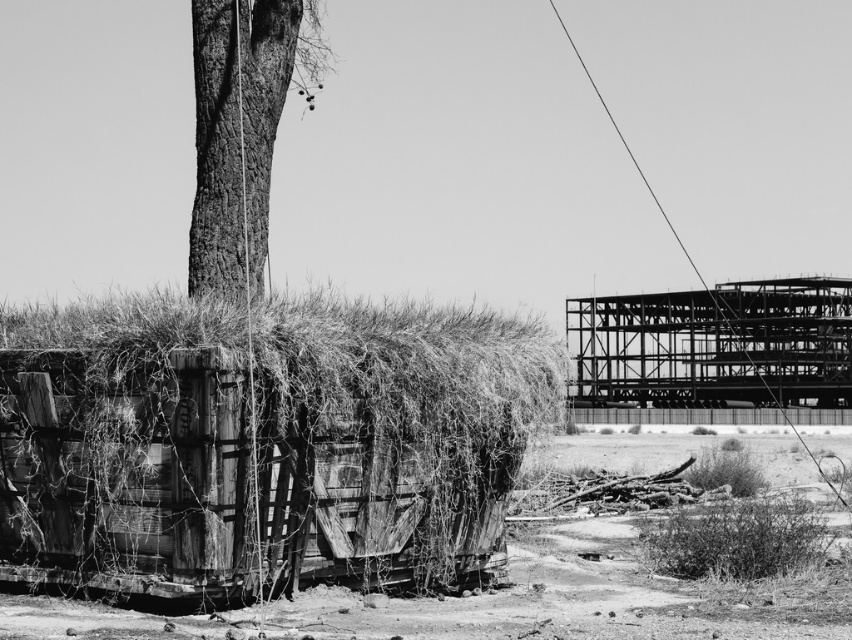
Question: Observing the image, what is the correct spatial positioning of rusty wood hay at left in reference to smooth bark tree at upper left?

Choices:
 (A) below
 (B) above

Answer: (A)

Question: Which of the following is the closest to the observer?

Choices:
 (A) metallic framework at right
 (B) smooth bark tree at upper left
 (C) rusty wood hay at left
 (D) dirt field at lower left

Answer: (D)

Question: Does rusty wood hay at left have a greater width compared to dirt field at lower left?

Choices:
 (A) yes
 (B) no

Answer: (B)

Question: Which point is closer to the camera taking this photo?

Choices:
 (A) (527, 428)
 (B) (470, 637)
 (C) (210, 252)

Answer: (B)

Question: Can you confirm if rusty wood hay at left is positioned above metallic framework at right?

Choices:
 (A) no
 (B) yes

Answer: (B)

Question: Which object is positioned closest to the metallic framework at right?

Choices:
 (A) rusty wood hay at left
 (B) smooth bark tree at upper left

Answer: (B)